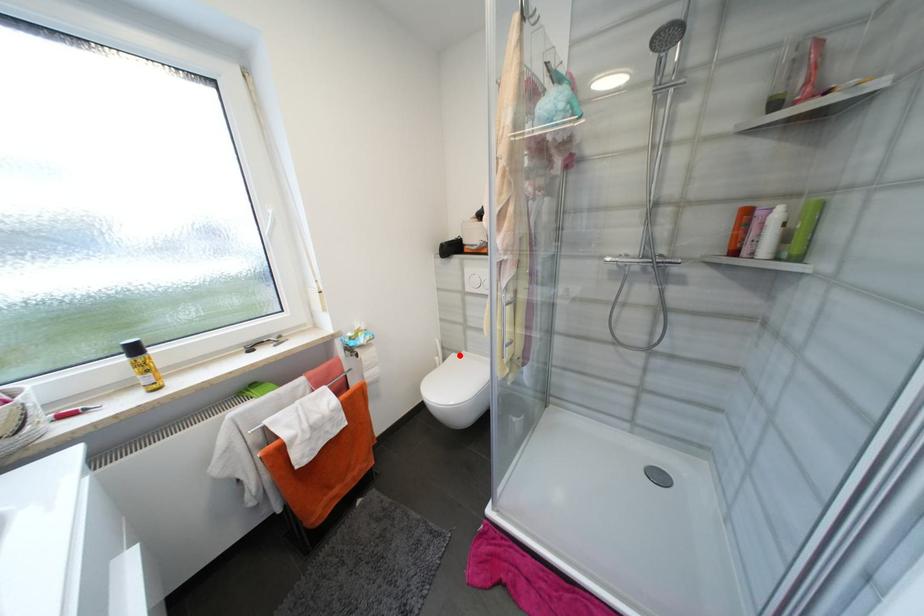
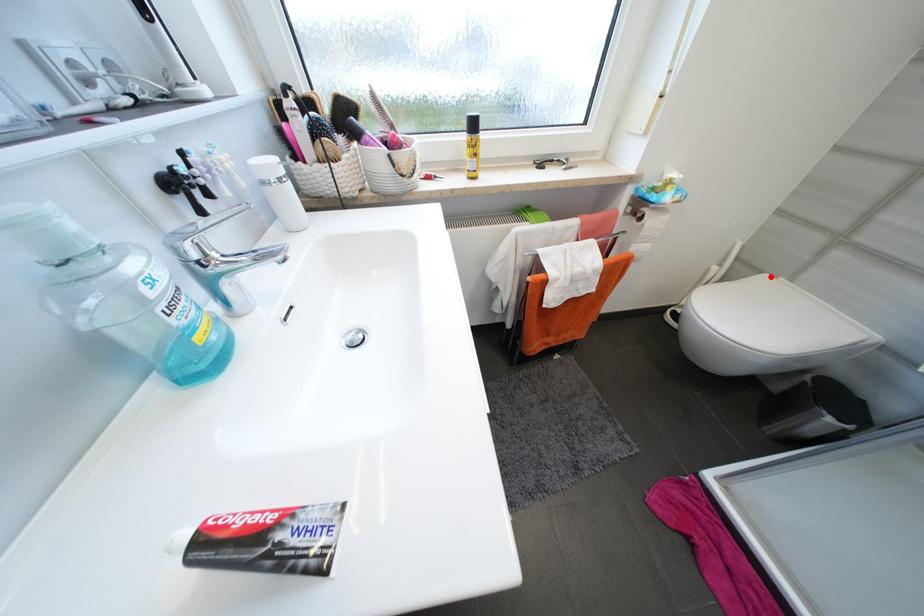
I am providing you with two images of the same scene from different viewpoints. A red point is marked on the first image and another point is marked on the second image. Does the point marked in image1 correspond to the same location as the one in image2?

Yes